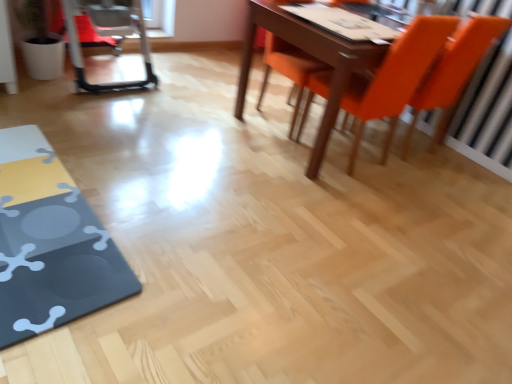
Identify the location of vacant area that is in front of orange matte chair at right, the first chair in the right-to-left sequence. Image resolution: width=512 pixels, height=384 pixels. (424, 184).